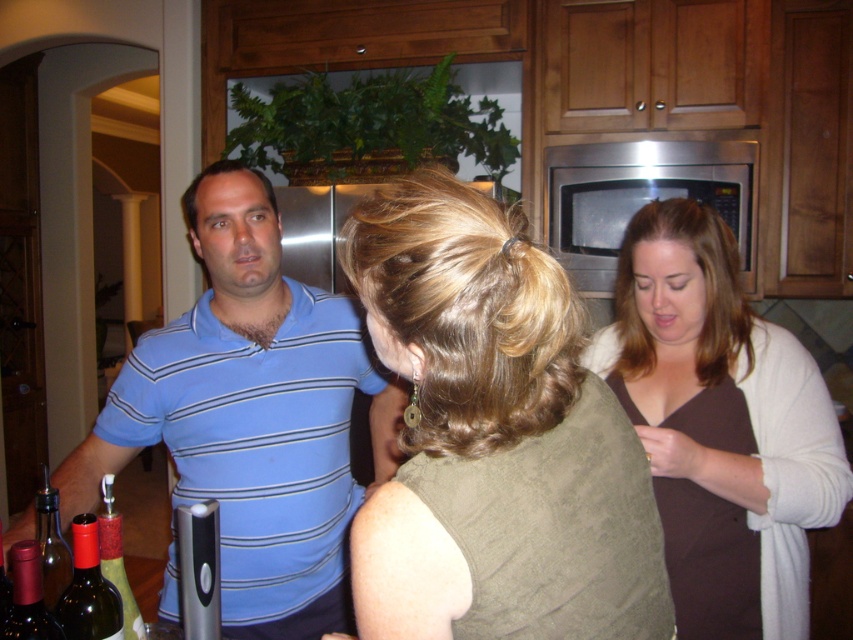
Question: Is matte olive green blouse at center closer to the viewer compared to stainless steel microwave at upper center?

Choices:
 (A) yes
 (B) no

Answer: (A)

Question: Can you confirm if blue striped polo shirt at left is positioned below dark red glass bottle at lower left?

Choices:
 (A) yes
 (B) no

Answer: (B)

Question: Estimate the real-world distances between objects in this image. Which object is farther from the blue striped polo shirt at left?

Choices:
 (A) translucent glass bottle at lower left
 (B) matte olive green blouse at center
 (C) brown matte sweater at upper right
 (D) dark red glass bottle at lower left

Answer: (B)

Question: Which object is closer to the camera taking this photo?

Choices:
 (A) translucent glass bottle at lower left
 (B) brown matte sweater at upper right
 (C) stainless steel microwave at upper center
 (D) blue striped polo shirt at left

Answer: (A)

Question: Is blue striped polo shirt at left wider than stainless steel microwave at upper center?

Choices:
 (A) yes
 (B) no

Answer: (B)

Question: Based on their relative distances, which object is nearer to the rubber stopper wine bottle at lower left?

Choices:
 (A) matte olive green blouse at center
 (B) dark red glass bottle at lower left
 (C) blue striped polo shirt at left

Answer: (B)